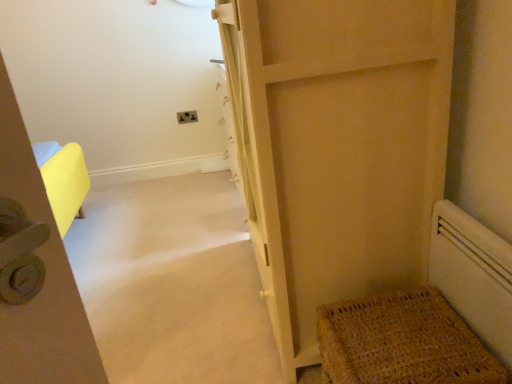
Question: Is matte wood door at center wider than matte plastic electric outlet at center?

Choices:
 (A) yes
 (B) no

Answer: (A)

Question: From the image's perspective, would you say matte wood door at center is shown under matte plastic electric outlet at center?

Choices:
 (A) yes
 (B) no

Answer: (A)

Question: From a real-world perspective, is matte wood door at center physically above matte plastic electric outlet at center?

Choices:
 (A) yes
 (B) no

Answer: (A)

Question: Is matte wood door at center smaller than matte plastic electric outlet at center?

Choices:
 (A) no
 (B) yes

Answer: (A)

Question: Could matte plastic electric outlet at center be considered to be inside matte wood door at center?

Choices:
 (A) no
 (B) yes

Answer: (A)

Question: Is matte wood door at center positioned beyond the bounds of matte plastic electric outlet at center?

Choices:
 (A) yes
 (B) no

Answer: (A)

Question: Can you see matte plastic electric outlet at center touching white matte radiator at lower right?

Choices:
 (A) no
 (B) yes

Answer: (A)

Question: Does matte plastic electric outlet at center have a larger size compared to white matte radiator at lower right?

Choices:
 (A) yes
 (B) no

Answer: (B)

Question: From the image's perspective, is matte plastic electric outlet at center located above white matte radiator at lower right?

Choices:
 (A) no
 (B) yes

Answer: (B)

Question: From the image's perspective, does matte plastic electric outlet at center appear lower than white matte radiator at lower right?

Choices:
 (A) yes
 (B) no

Answer: (B)

Question: Is the depth of matte plastic electric outlet at center less than that of white matte radiator at lower right?

Choices:
 (A) no
 (B) yes

Answer: (A)

Question: From a real-world perspective, is matte plastic electric outlet at center on top of white matte radiator at lower right?

Choices:
 (A) no
 (B) yes

Answer: (B)

Question: Is woven brown mat at lower right at the right side of matte wood door at center?

Choices:
 (A) yes
 (B) no

Answer: (A)